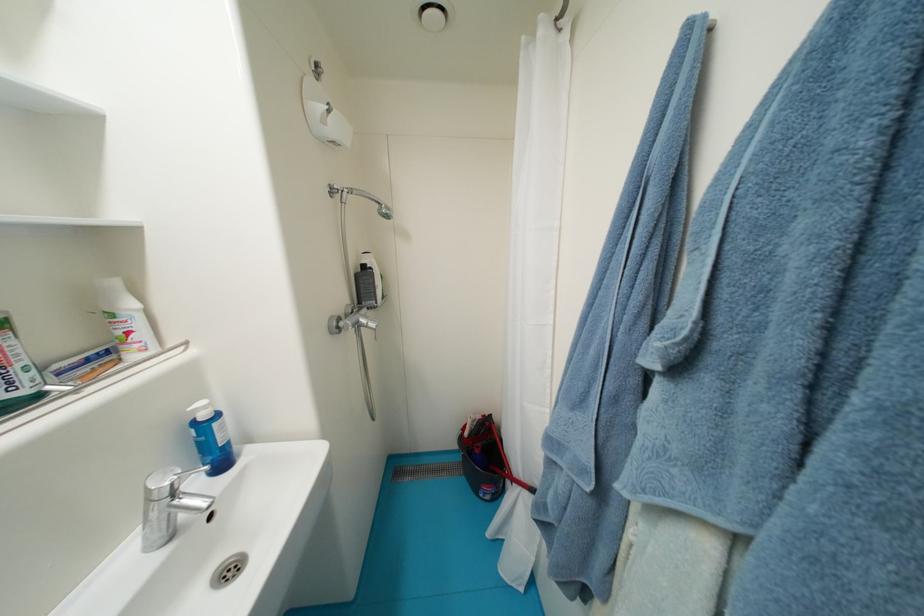
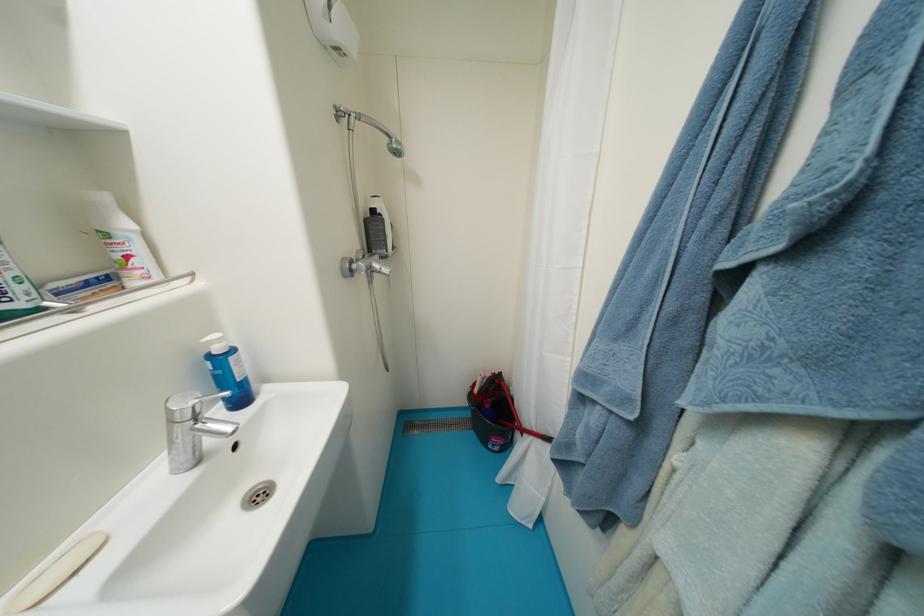
Find the pixel in the second image that matches [180,495] in the first image.

(203, 419)